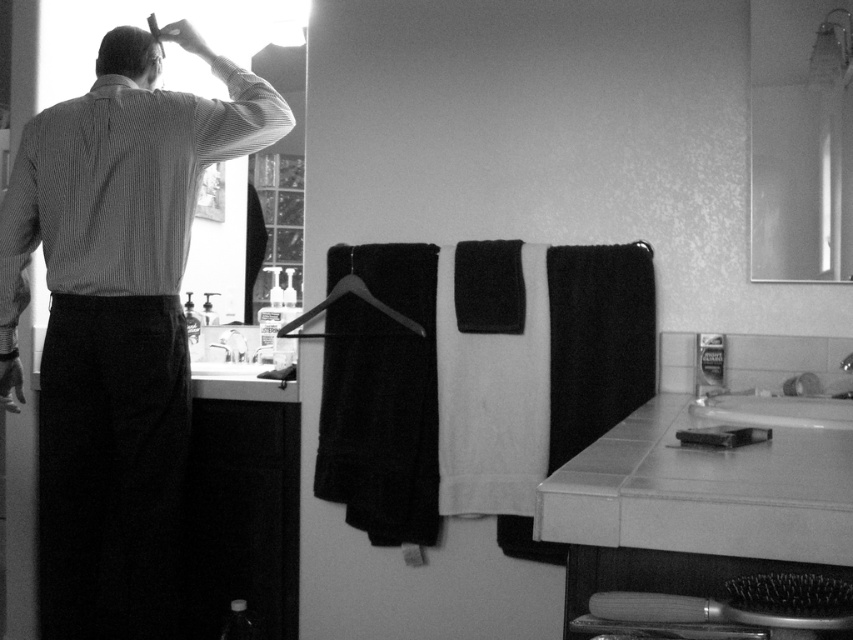
Question: Can you confirm if glossy glass mirror at upper right is wider than white glossy sink at lower center?

Choices:
 (A) no
 (B) yes

Answer: (A)

Question: Which point appears closest to the camera in this image?

Choices:
 (A) (244, 346)
 (B) (242, 355)
 (C) (718, 428)

Answer: (C)

Question: Which of the following is the farthest from the observer?

Choices:
 (A) (239, 339)
 (B) (674, 618)
 (C) (112, 68)

Answer: (A)

Question: Can you confirm if textured dark fabric robe at left is smaller than glossy glass mirror at upper right?

Choices:
 (A) yes
 (B) no

Answer: (B)

Question: Can you confirm if glossy glass mirror at upper right is positioned to the right of dark brown hair at upper left?

Choices:
 (A) no
 (B) yes

Answer: (B)

Question: Among these objects, which one is farthest from the camera?

Choices:
 (A) textured dark fabric robe at left
 (B) metallic silver towel bar at lower right

Answer: (A)